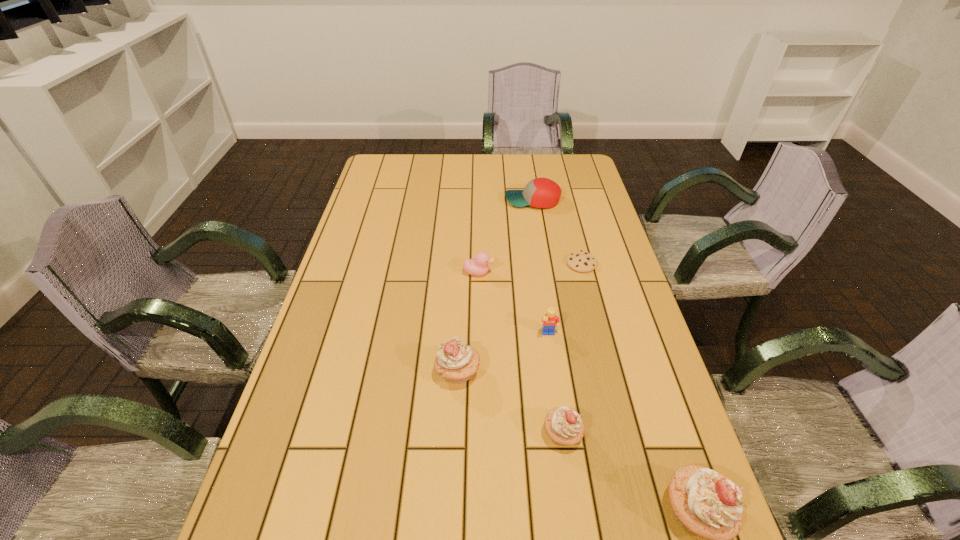
Identify the location of the farthest cupcake. (456, 361).

Image resolution: width=960 pixels, height=540 pixels. Identify the location of the leftmost cupcake. (456, 361).

You are a GUI agent. You are given a task and a screenshot of the screen. Output one action in this format:
    pyautogui.click(x=<x>, y=<y>)
    Task: Click on the shortest cupcake
    The image size is (960, 540).
    Given the screenshot: What is the action you would take?
    pyautogui.click(x=564, y=426)

This screenshot has height=540, width=960. I want to click on the second cupcake from left to right, so click(564, 426).

In order to click on baseball cap in this screenshot , I will do `click(540, 192)`.

Locate an element on the screen. duckling is located at coordinates (479, 266).

The width and height of the screenshot is (960, 540). In order to click on the fourth nearest object in this screenshot , I will do coord(550,320).

At what (x,y) coordinates should I click in order to perform the action: click on cookie. Please return your answer as a coordinate pair (x, y). The height and width of the screenshot is (540, 960). Looking at the image, I should click on point(584,262).

Locate an element on the screen. Image resolution: width=960 pixels, height=540 pixels. vacant space situated 0.160m on the back of the leftmost cupcake is located at coordinates (461, 309).

Find the location of a particular element. vacant region located 0.200m on the back of the second cupcake from right to left is located at coordinates point(549,346).